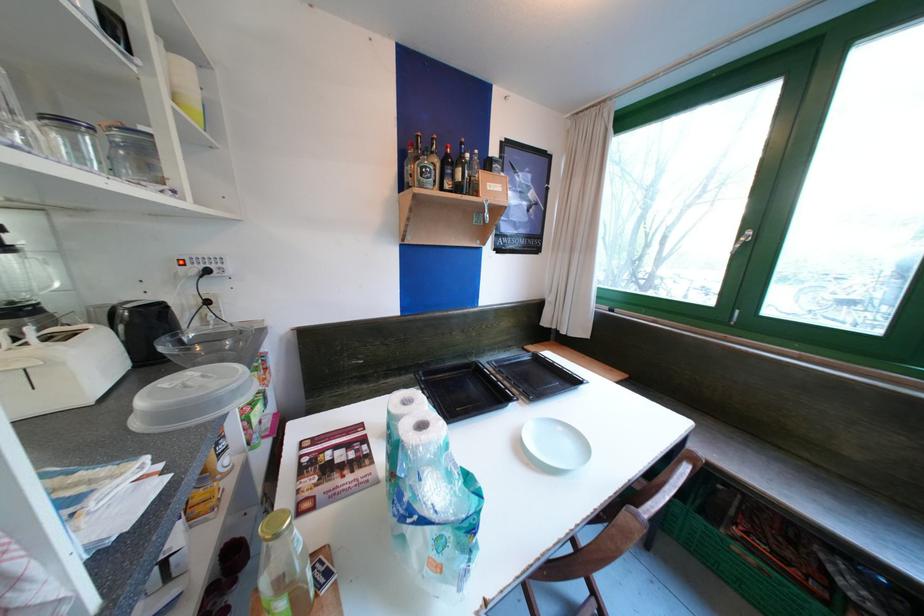
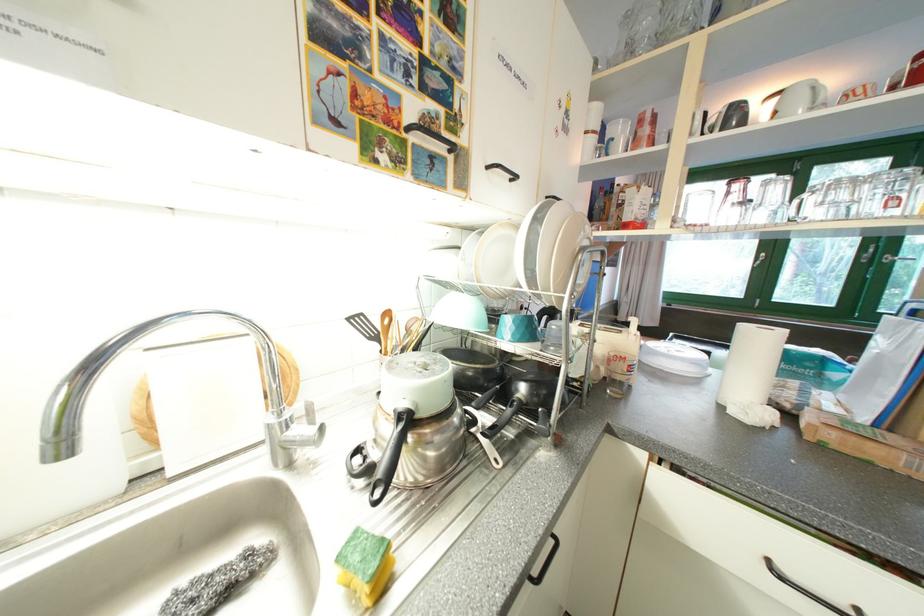
Question: The images are taken continuously from a first-person perspective. In which direction are you moving?

Choices:
 (A) Left
 (B) Right
 (C) Forward
 (D) Backward

Answer: (A)